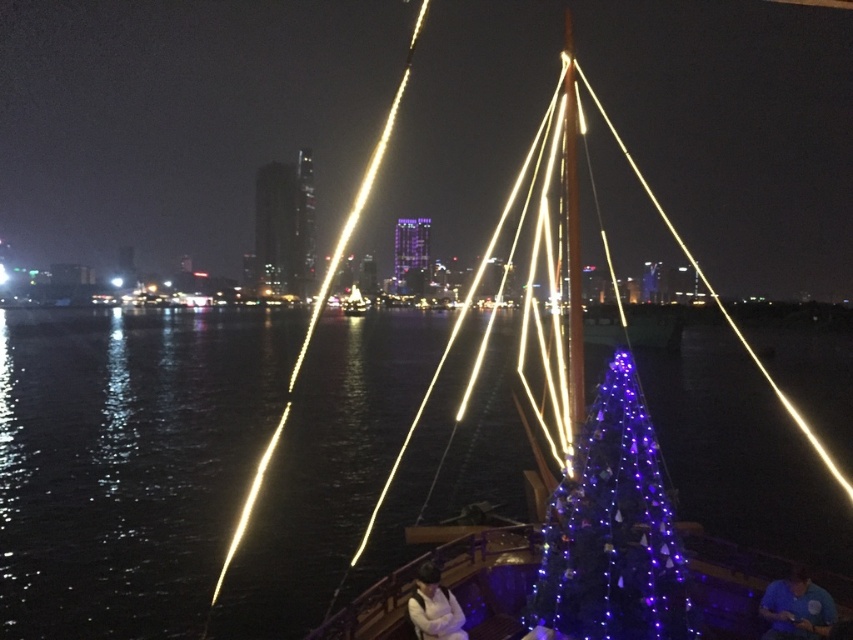
Question: Which object is closer to the camera taking this photo?

Choices:
 (A) metallic gold mast at center
 (B) purple glossy christmas tree at center

Answer: (B)

Question: Observing the image, what is the correct spatial positioning of purple glossy christmas tree at center in reference to metallic gold mast at center?

Choices:
 (A) below
 (B) above

Answer: (A)

Question: Which point is closer to the camera?

Choices:
 (A) metallic gold mast at center
 (B) purple glossy christmas tree at center

Answer: (B)

Question: Is purple glossy christmas tree at center above metallic gold mast at center?

Choices:
 (A) no
 (B) yes

Answer: (A)

Question: Does purple glossy christmas tree at center have a lesser width compared to metallic gold mast at center?

Choices:
 (A) no
 (B) yes

Answer: (B)